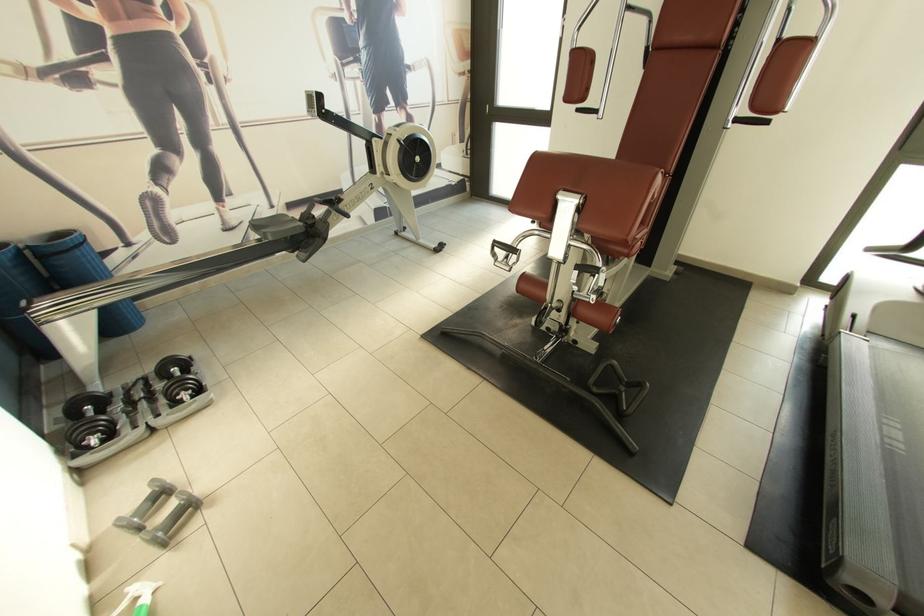
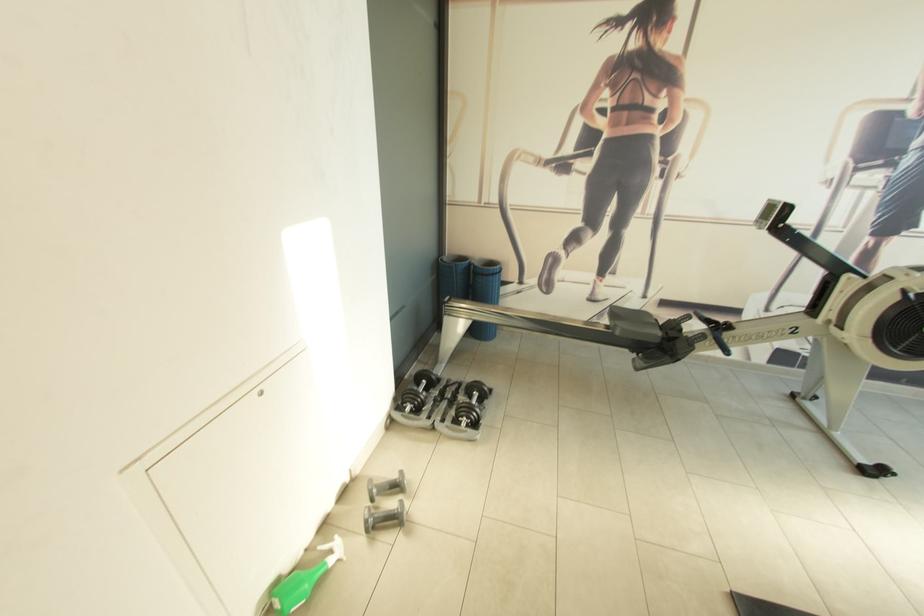
Where in the second image is the point corresponding to (190,391) from the first image?

(472, 419)